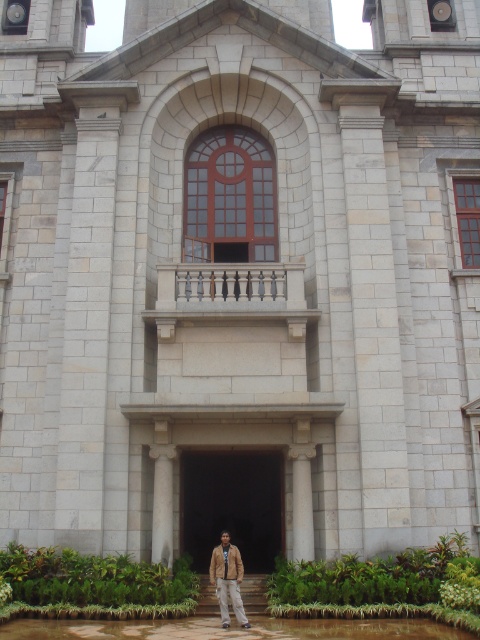
Between white marble pillar at center and brown leather jacket at lower center, which one has less height?

white marble pillar at center

Between white marble pillar at center and brown leather jacket at lower center, which one is positioned higher?

Positioned higher is white marble pillar at center.

Does point (167, 497) come closer to viewer compared to point (214, 580)?

No, (167, 497) is behind (214, 580).

Locate an element on the screen. white marble pillar at center is located at coordinates (163, 502).

Measure the distance between dark stone door at center and camera.

The distance of dark stone door at center from camera is 50.41 meters.

Between dark stone door at center and white marble pillar at center, which one is positioned higher?

white marble pillar at center

Who is more distant from viewer, (222, 458) or (157, 481)?

The point (222, 458) is more distant.

You are a GUI agent. You are given a task and a screenshot of the screen. Output one action in this format:
    pyautogui.click(x=<x>, y=<y>)
    Task: Click on the dark stone door at center
    
    Given the screenshot: What is the action you would take?
    pyautogui.click(x=231, y=506)

Is dark stone door at center above brown leather jacket at lower center?

Correct, dark stone door at center is located above brown leather jacket at lower center.

Between dark stone door at center and brown leather jacket at lower center, which one appears on the right side from the viewer's perspective?

dark stone door at center is more to the right.

Between point (267, 532) and point (236, 557), which one is positioned behind?

The point (267, 532) is behind.

Find the location of a particular element. dark stone door at center is located at coordinates (231, 506).